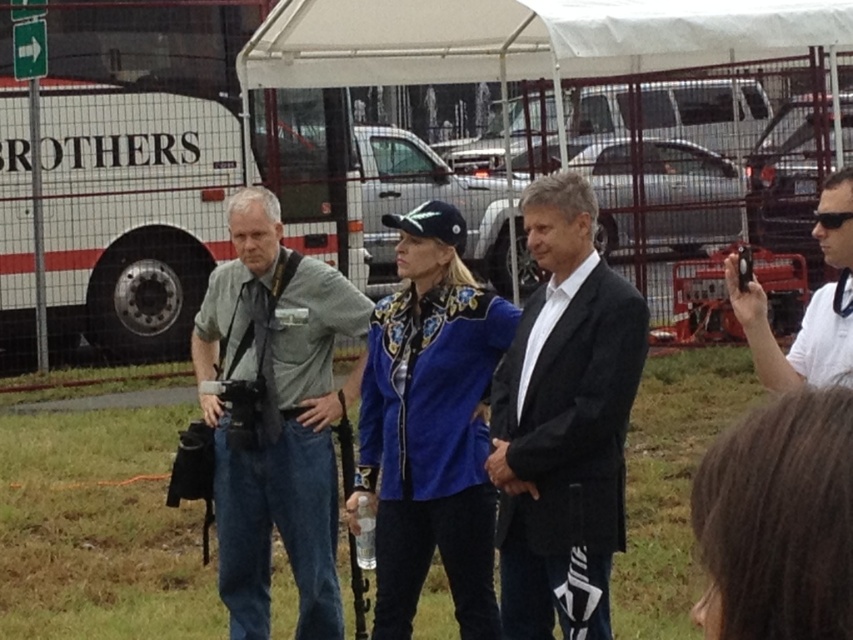
Question: Is black textured suit at center thinner than white fabric canopy at upper center?

Choices:
 (A) yes
 (B) no

Answer: (A)

Question: Is the position of gray cotton shirt at left more distant than that of white fabric canopy at upper center?

Choices:
 (A) yes
 (B) no

Answer: (B)

Question: Does gray cotton shirt at left appear on the right side of blue suede jacket at center?

Choices:
 (A) no
 (B) yes

Answer: (A)

Question: Which of the following is the farthest from the observer?

Choices:
 (A) (788, 285)
 (B) (355, 3)
 (C) (830, 355)

Answer: (A)

Question: Estimate the real-world distances between objects in this image. Which object is closer to the black matte camera at right?

Choices:
 (A) gray cotton shirt at left
 (B) white fabric canopy at upper center

Answer: (A)

Question: Among these objects, which one is nearest to the camera?

Choices:
 (A) black matte camera at right
 (B) black textured suit at center
 (C) white fabric canopy at upper center

Answer: (A)